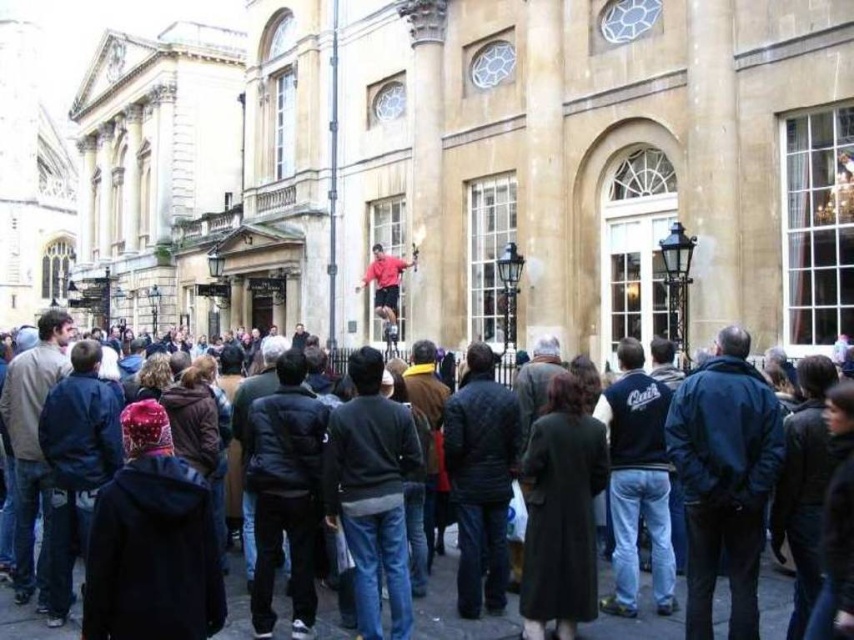
Question: Observing the image, what is the correct spatial positioning of red jacket at center in reference to matte red shirt at center?

Choices:
 (A) above
 (B) below

Answer: (B)

Question: Is red jacket at center smaller than matte red shirt at center?

Choices:
 (A) yes
 (B) no

Answer: (B)

Question: Which of the following is the farthest from the observer?

Choices:
 (A) matte red shirt at center
 (B) red jacket at center

Answer: (A)

Question: Is red jacket at center above matte red shirt at center?

Choices:
 (A) yes
 (B) no

Answer: (B)